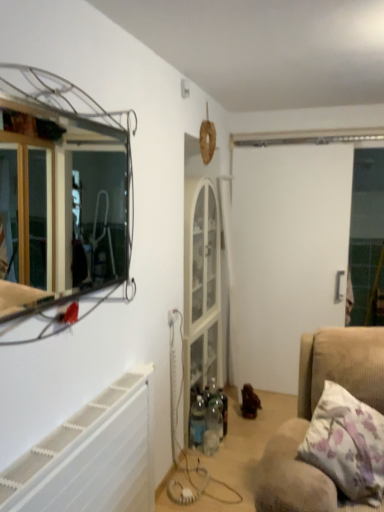
Locate an element on the screen. The width and height of the screenshot is (384, 512). unoccupied space behind brown wooden toy at center is located at coordinates (261, 401).